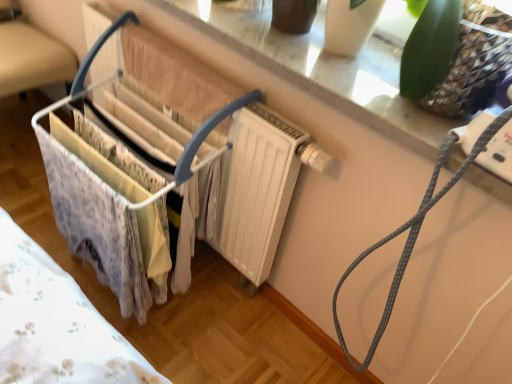
Locate an element on the screen. The height and width of the screenshot is (384, 512). metallic wire basket at left is located at coordinates (30, 55).

This screenshot has width=512, height=384. I want to click on gray dotted string at upper right, so click(413, 233).

What do you see at coordinates (112, 208) in the screenshot? I see `white plastic baby carriage at left` at bounding box center [112, 208].

What do you see at coordinates (325, 72) in the screenshot? I see `white glossy window sill at upper center` at bounding box center [325, 72].

Locate an element on the screen. This screenshot has height=384, width=512. metallic wire basket at left is located at coordinates (30, 55).

Is white plastic baby carriage at left oriented towards gray dotted string at upper right?

No, white plastic baby carriage at left does not turn towards gray dotted string at upper right.

From the image's perspective, between white plastic baby carriage at left and gray dotted string at upper right, who is located below?

gray dotted string at upper right is shown below in the image.

Between white plastic baby carriage at left and gray dotted string at upper right, which one is positioned in front?

gray dotted string at upper right is in front.

From a real-world perspective, is white plastic baby carriage at left positioned over gray dotted string at upper right based on gravity?

Actually, white plastic baby carriage at left is physically below gray dotted string at upper right in the real world.

Is metallic wire basket at left positioned with its back to gray dotted string at upper right?

metallic wire basket at left does not have its back to gray dotted string at upper right.

Which is more to the right, metallic wire basket at left or gray dotted string at upper right?

Positioned to the right is gray dotted string at upper right.

From the image's perspective, which one is positioned lower, metallic wire basket at left or gray dotted string at upper right?

From the image's view, gray dotted string at upper right is below.

Who is more distant, metallic wire basket at left or gray dotted string at upper right?

metallic wire basket at left.

In the scene shown: Is the depth of white glossy window sill at upper center greater than that of metallic wire basket at left?

No, it is not.

Which object is positioned more to the right, white glossy window sill at upper center or metallic wire basket at left?

Positioned to the right is white glossy window sill at upper center.

Based on the photo, would you say white glossy window sill at upper center is outside metallic wire basket at left?

Indeed, white glossy window sill at upper center is completely outside metallic wire basket at left.

Consider the image. Considering the relative positions of metallic wire basket at left and white plastic baby carriage at left in the image provided, is metallic wire basket at left to the right of white plastic baby carriage at left from the viewer's perspective?

In fact, metallic wire basket at left is to the left of white plastic baby carriage at left.

Is metallic wire basket at left directly adjacent to white plastic baby carriage at left?

metallic wire basket at left and white plastic baby carriage at left are not in contact.

Is metallic wire basket at left in front of or behind white plastic baby carriage at left in the image?

metallic wire basket at left is behind white plastic baby carriage at left.

How many degrees apart are the facing directions of metallic wire basket at left and white plastic baby carriage at left?

88 degrees.

Is white plastic baby carriage at left positioned far away from metallic wire basket at left?

They are positioned close to each other.

Where is `furniture above the white plastic baby carriage at left (from the image's perspective)`? furniture above the white plastic baby carriage at left (from the image's perspective) is located at coordinates (30, 55).

In the scene shown: Is metallic wire basket at left located within white plastic baby carriage at left?

No, metallic wire basket at left is located outside of white plastic baby carriage at left.

Which object is further away from the camera taking this photo, white plastic baby carriage at left or metallic wire basket at left?

metallic wire basket at left is further away from the camera.

From the image's perspective, is gray dotted string at upper right below white glossy window sill at upper center?

Indeed, from the image's perspective, gray dotted string at upper right is shown beneath white glossy window sill at upper center.

Considering the sizes of gray dotted string at upper right and white glossy window sill at upper center in the image, is gray dotted string at upper right wider or thinner than white glossy window sill at upper center?

Considering their sizes, gray dotted string at upper right looks broader than white glossy window sill at upper center.

Is point (377, 337) positioned behind point (412, 130)?

Yes, point (377, 337) is behind point (412, 130).

Can you confirm if gray dotted string at upper right is positioned to the right of white glossy window sill at upper center?

Correct, you'll find gray dotted string at upper right to the right of white glossy window sill at upper center.

Are gray dotted string at upper right and metallic wire basket at left making contact?

gray dotted string at upper right and metallic wire basket at left are clearly separated.

How far apart are gray dotted string at upper right and metallic wire basket at left?

1.48 meters.

Is gray dotted string at upper right not within metallic wire basket at left?

Yes.

Considering the sizes of objects gray dotted string at upper right and metallic wire basket at left in the image provided, who is shorter, gray dotted string at upper right or metallic wire basket at left?

metallic wire basket at left is shorter.

There is a white plastic baby carriage at left. Identify the location of string above it (from a real-world perspective). This screenshot has height=384, width=512. (413, 233).

Where is `string in front of the metallic wire basket at left`? string in front of the metallic wire basket at left is located at coordinates (x=413, y=233).

Estimate the real-world distances between objects in this image. Which object is closer to white glossy window sill at upper center, white plastic baby carriage at left or gray dotted string at upper right?

gray dotted string at upper right.

When comparing their distances from gray dotted string at upper right, does metallic wire basket at left or white glossy window sill at upper center seem further?

metallic wire basket at left lies further to gray dotted string at upper right than the other object.

Considering their positions, is white plastic baby carriage at left positioned further to metallic wire basket at left than gray dotted string at upper right?

gray dotted string at upper right is positioned further to the anchor metallic wire basket at left.

Which object lies further to the anchor point white glossy window sill at upper center, metallic wire basket at left or gray dotted string at upper right?

metallic wire basket at left is further to white glossy window sill at upper center.

Considering their positions, is white glossy window sill at upper center positioned further to white plastic baby carriage at left than metallic wire basket at left?

Among the two, metallic wire basket at left is located further to white plastic baby carriage at left.

When comparing their distances from gray dotted string at upper right, does metallic wire basket at left or white plastic baby carriage at left seem closer?

white plastic baby carriage at left lies closer to gray dotted string at upper right than the other object.

Estimate the real-world distances between objects in this image. Which object is further from white glossy window sill at upper center, white plastic baby carriage at left or metallic wire basket at left?

The object further to white glossy window sill at upper center is metallic wire basket at left.

Estimate the real-world distances between objects in this image. Which object is further from white plastic baby carriage at left, metallic wire basket at left or white glossy window sill at upper center?

Among the two, metallic wire basket at left is located further to white plastic baby carriage at left.

Locate an element on the screen. This screenshot has width=512, height=384. window sill between metallic wire basket at left and gray dotted string at upper right in the horizontal direction is located at coordinates (325, 72).

Locate an element on the screen. baby carriage between metallic wire basket at left and gray dotted string at upper right in the horizontal direction is located at coordinates point(112,208).

I want to click on window sill situated between white plastic baby carriage at left and gray dotted string at upper right from left to right, so click(x=325, y=72).

The image size is (512, 384). Identify the location of baby carriage situated between metallic wire basket at left and white glossy window sill at upper center from left to right. (112, 208).